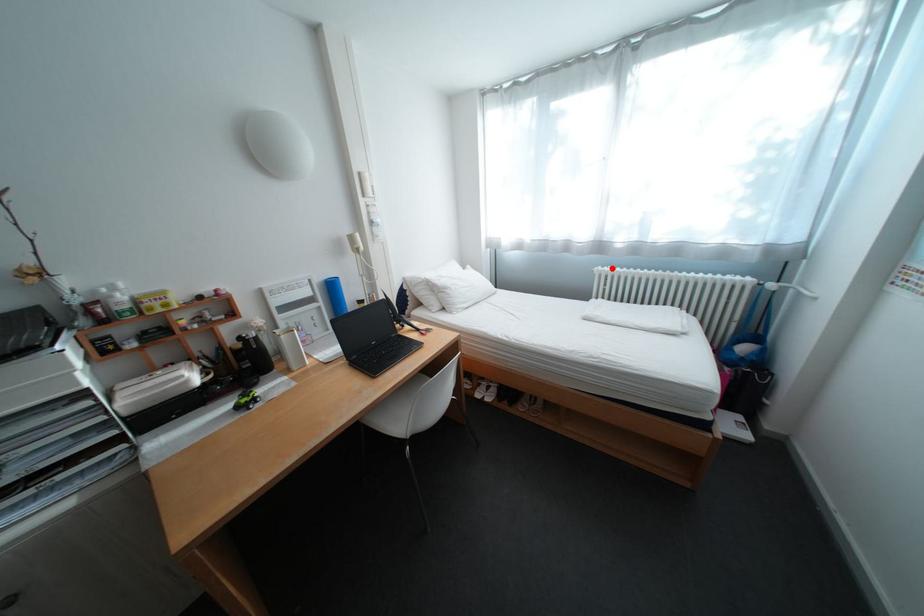
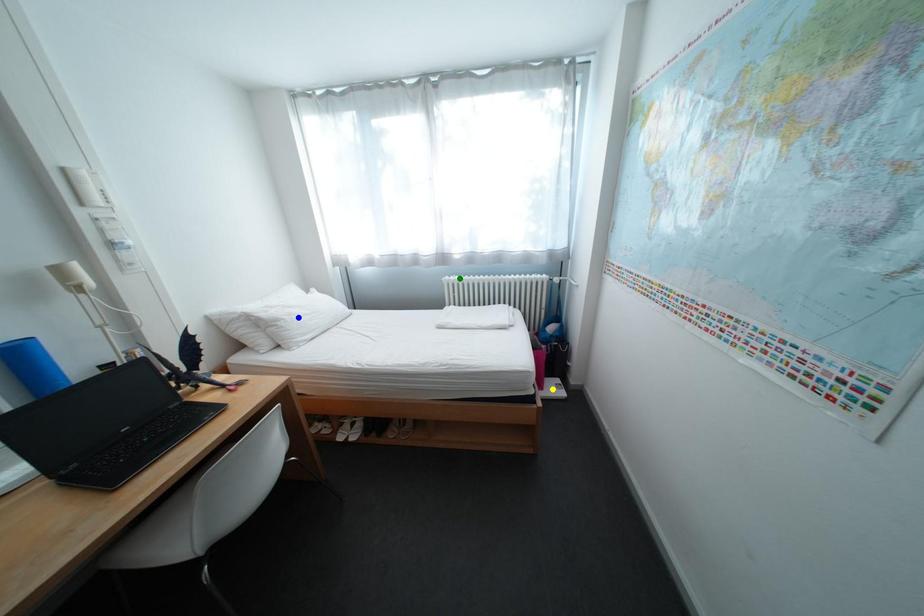
Question: I am providing you with two images of the same scene from different viewpoints. A red point is marked on the first image. You are given multiple points on the second image. Which point in image 2 represents the same 3d spot as the red point in image 1?

Choices:
 (A) green point
 (B) blue point
 (C) yellow point

Answer: (A)